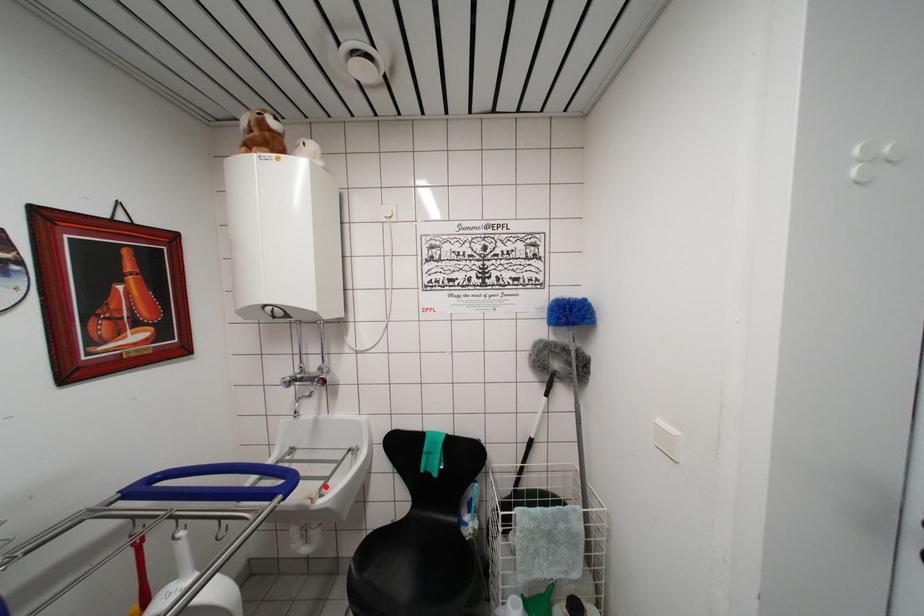
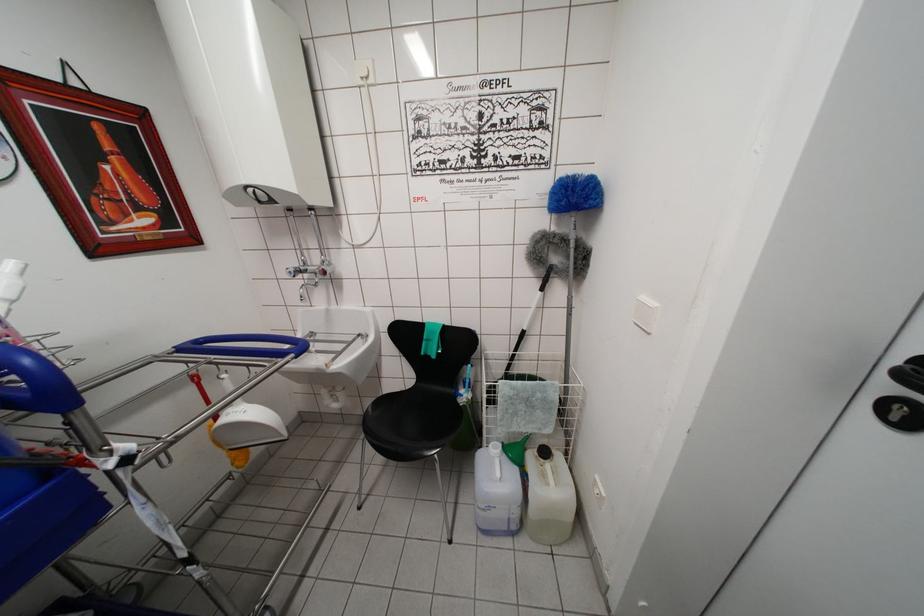
Where in the second image is the point corresponding to the highlighted location from the first image?

(338, 360)